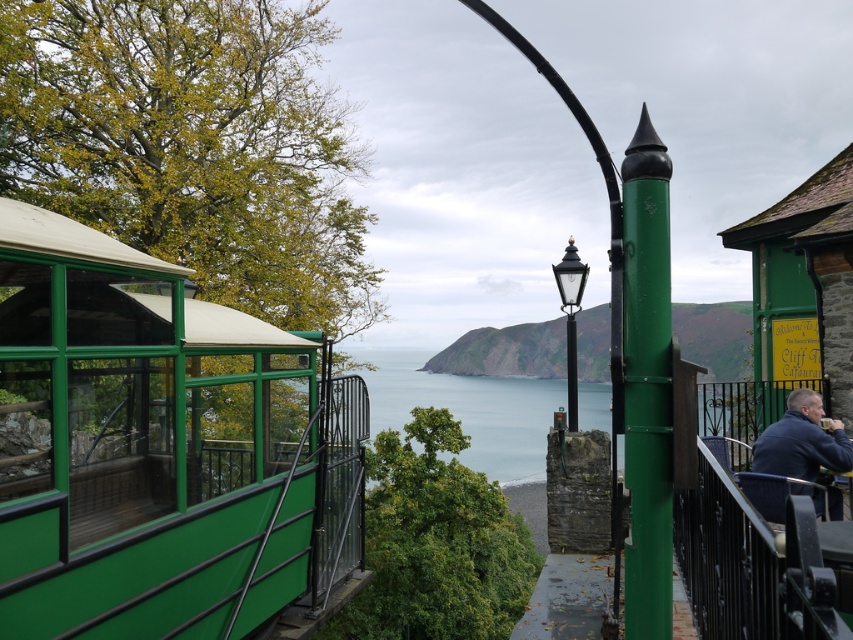
You are standing at the point labeled as point (160, 449) in the image. What object are you standing on?

You are standing on the green matte glass cable car at left.

From the picture: You are standing at the cliffside location and want to take a photo of the two points marked in the scene. Which point, point (840, 429) or point (576, 352), will appear larger in your camera view?

Point (840, 429) will appear larger in your camera view because it is closer to the camera than point (576, 352).

You are a tour guide leading a group to the cliffside viewpoint. You notice two items in the scene. One is a blue fabric jacket at right and the other is a black polished metal streetlight at center. Which item is located to the left of the other?

The blue fabric jacket at right is positioned on the left side of black polished metal streetlight at center.